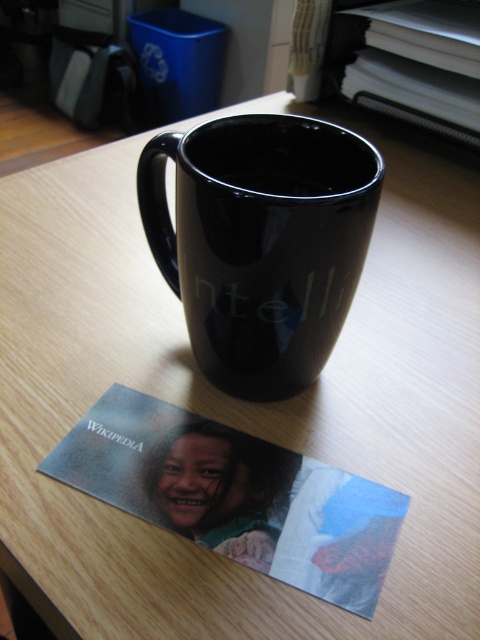
What are the coordinates of `glossy ceramic mug at center` in the screenshot? It's located at (262, 243).

Is point (275, 326) less distant than point (56, 461)?

Yes, it is in front of point (56, 461).

Is point (286, 288) positioned before point (327, 522)?

No.

Identify the location of glossy ceramic mug at center. (262, 243).